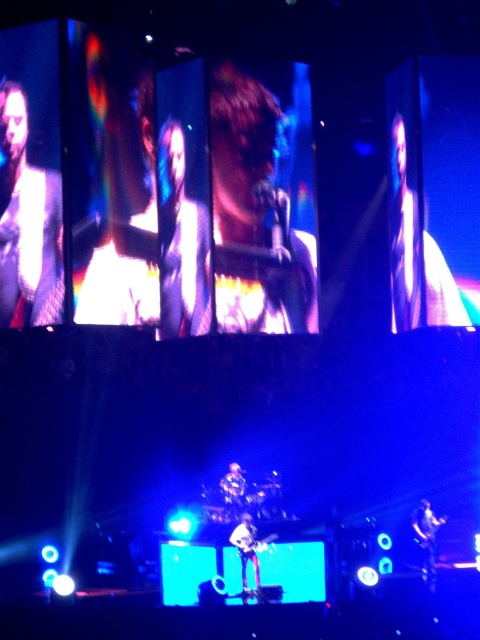
Question: Which of these objects is positioned farthest from the matte black microphone at upper right?

Choices:
 (A) shiny silver guitar at lower right
 (B) shiny silver guitar at center
 (C) shiny silver microphone at center
 (D) matte black jacket at left

Answer: (D)

Question: Which object is the closest to the shiny silver guitar at lower right?

Choices:
 (A) shiny silver microphone at center
 (B) matte black microphone at upper right

Answer: (A)

Question: Is shiny silver guitar at lower right bigger than shiny silver guitar at center?

Choices:
 (A) no
 (B) yes

Answer: (B)

Question: Can you confirm if matte black microphone at upper right is smaller than shiny silver microphone at center?

Choices:
 (A) no
 (B) yes

Answer: (B)

Question: Which point is farther from the camera taking this photo?

Choices:
 (A) (13, 273)
 (B) (421, 508)

Answer: (B)

Question: Does matte black microphone at upper right appear over shiny silver guitar at lower right?

Choices:
 (A) yes
 (B) no

Answer: (A)